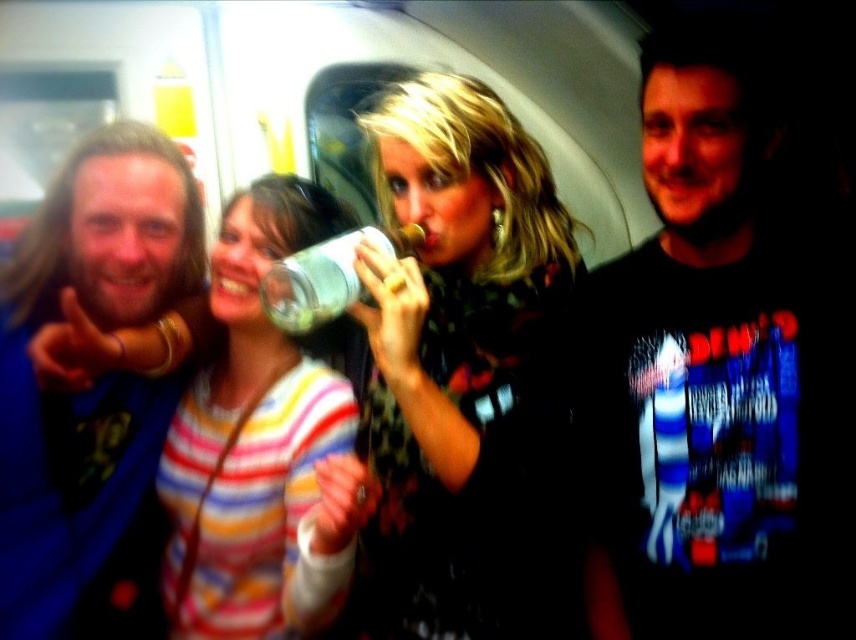
Question: Which point is closer to the camera?

Choices:
 (A) striped sweater at center
 (B) black printed t-shirt at right

Answer: (A)

Question: Among these objects, which one is farthest from the camera?

Choices:
 (A) long hair man at left
 (B) transparent plastic bottle at center
 (C) black printed t-shirt at right
 (D) striped sweater at center

Answer: (A)

Question: Among these objects, which one is nearest to the camera?

Choices:
 (A) floral-patterned shirt at center
 (B) long hair man at left
 (C) transparent plastic bottle at center
 (D) striped sweater at center

Answer: (D)

Question: Is floral-patterned shirt at center positioned behind long hair man at left?

Choices:
 (A) no
 (B) yes

Answer: (A)

Question: Can you confirm if black printed t-shirt at right is positioned below long hair man at left?

Choices:
 (A) yes
 (B) no

Answer: (B)

Question: Where is floral-patterned shirt at center located in relation to transparent plastic bottle at center in the image?

Choices:
 (A) above
 (B) below

Answer: (B)